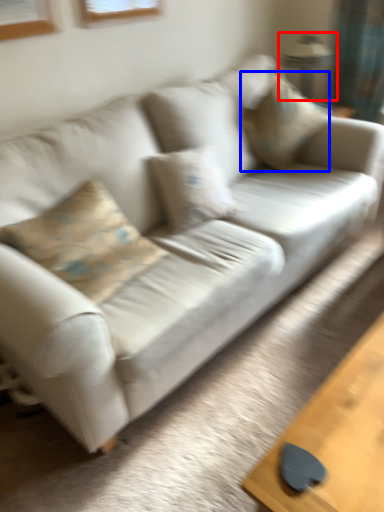
Question: Which object is further to the camera taking this photo, lamp (highlighted by a red box) or pillow (highlighted by a blue box)?

Choices:
 (A) lamp
 (B) pillow

Answer: (A)